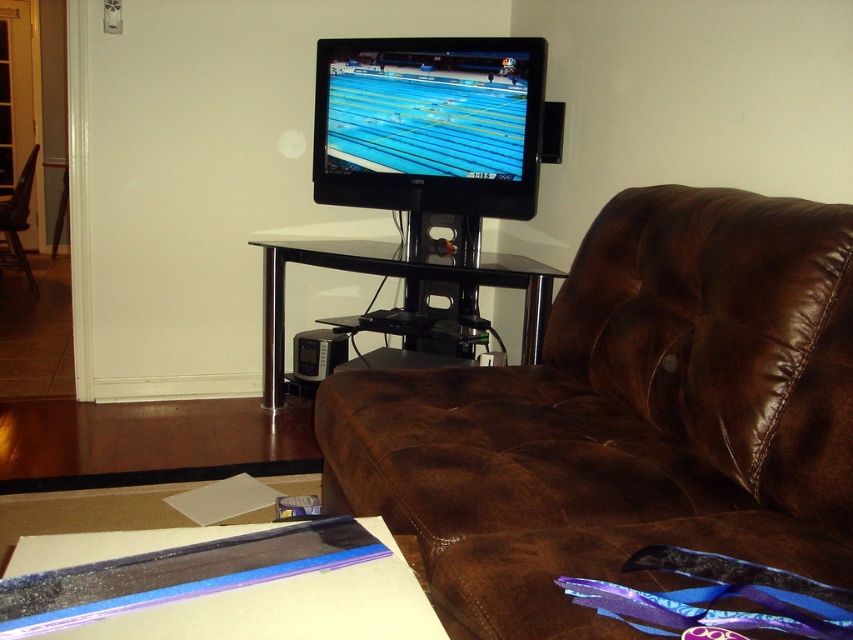
Locate an element on the screen. The height and width of the screenshot is (640, 853). brown leather couch at center is located at coordinates (627, 417).

Can you confirm if brown leather couch at center is positioned above black glass entertainment center at center?

Incorrect, brown leather couch at center is not positioned above black glass entertainment center at center.

Is point (468, 381) positioned after point (270, 248)?

No, it is in front of (270, 248).

This screenshot has width=853, height=640. I want to click on brown leather couch at center, so click(x=627, y=417).

Does matte black tv at center appear on the left side of black plastic chair at left?

Incorrect, matte black tv at center is not on the left side of black plastic chair at left.

Who is more distant from viewer, (345, 67) or (33, 147)?

Point (33, 147)

Does point (326, 104) come farther from viewer compared to point (19, 182)?

No, it is not.

This screenshot has height=640, width=853. What are the coordinates of `matte black tv at center` in the screenshot? It's located at (428, 124).

Locate an element on the screen. matte black tv at center is located at coordinates (428, 124).

Is matte black tv at center thinner than translucent plastic flat at lower left?

Incorrect, matte black tv at center's width is not less than translucent plastic flat at lower left's.

Is point (495, 198) closer to camera compared to point (233, 625)?

That is False.

Image resolution: width=853 pixels, height=640 pixels. What are the coordinates of `matte black tv at center` in the screenshot? It's located at (428, 124).